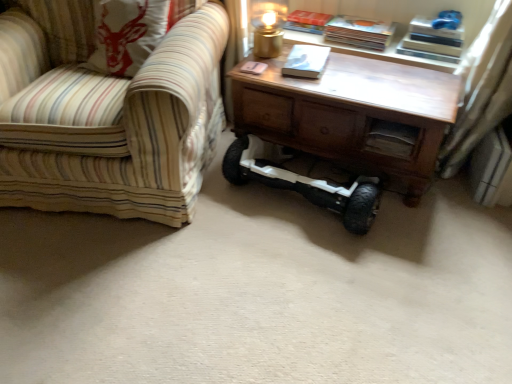
Where is `vacant space to the right of white matte hoverboard at center`? The image size is (512, 384). vacant space to the right of white matte hoverboard at center is located at coordinates (431, 235).